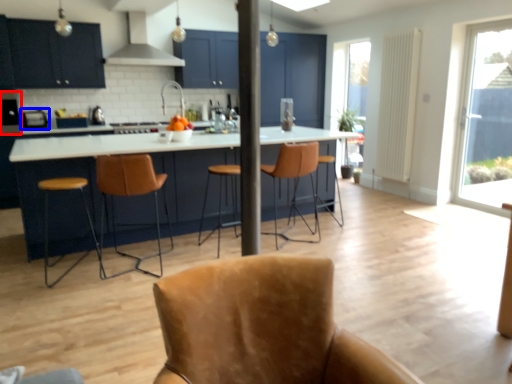
Question: Which object appears closest to the camera in this image, appliance (highlighted by a red box) or appliance (highlighted by a blue box)?

Choices:
 (A) appliance
 (B) appliance

Answer: (A)